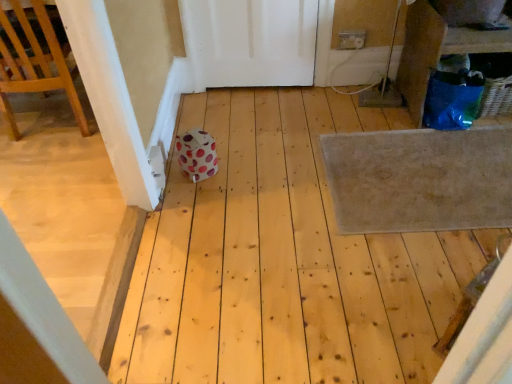
This screenshot has height=384, width=512. I want to click on wooden chair at left, so click(x=35, y=59).

Describe the element at coordinates (35, 59) in the screenshot. I see `wooden chair at left` at that location.

Find the location of `wooden chair at left`. wooden chair at left is located at coordinates (35, 59).